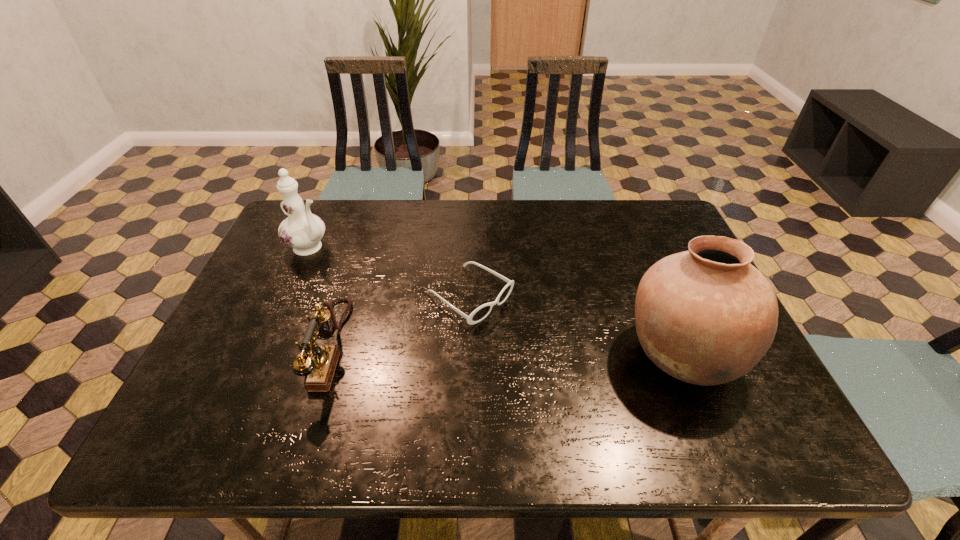
I want to click on free space between the rightmost object and the third object from right to left, so click(x=506, y=350).

Select which object appears as the second closest to the chinaware. Please provide its 2D coordinates. Your answer should be formatted as a tuple, i.e. [(x, y)], where the tuple contains the x and y coordinates of a point satisfying the conditions above.

[(481, 312)]

This screenshot has height=540, width=960. I want to click on object that stands as the closest to the shortest object, so click(x=319, y=363).

You are a GUI agent. You are given a task and a screenshot of the screen. Output one action in this format:
    pyautogui.click(x=<x>, y=<y>)
    Task: Click on the free location that satisfies the following two spatial constraints: 1. on the front side of the chinaware; 2. on the right side of the pottery
    Image resolution: width=960 pixels, height=540 pixels.
    Given the screenshot: What is the action you would take?
    pyautogui.click(x=263, y=354)

At what (x,y) coordinates should I click in order to perform the action: click on free point that satisfies the following two spatial constraints: 1. on the front side of the chinaware; 2. on the right side of the rightmost object. Please return your answer as a coordinate pair (x, y). The height and width of the screenshot is (540, 960). Looking at the image, I should click on (263, 354).

Locate an element on the screen. The image size is (960, 540). vacant space that satisfies the following two spatial constraints: 1. on the front side of the rightmost object; 2. on the right side of the second object from right to left is located at coordinates (468, 354).

At what (x,y) coordinates should I click in order to perform the action: click on free space that satisfies the following two spatial constraints: 1. on the front side of the pottery; 2. on the left side of the chinaware. Please return your answer as a coordinate pair (x, y). Looking at the image, I should click on (263, 354).

This screenshot has height=540, width=960. In order to click on free location that satisfies the following two spatial constraints: 1. on the front side of the telephone; 2. on the front-facing side of the farthest object in this screenshot , I will do `click(266, 346)`.

This screenshot has width=960, height=540. I want to click on vacant space that satisfies the following two spatial constraints: 1. on the front side of the farthest object; 2. on the front-facing side of the second object from left to right, so [266, 346].